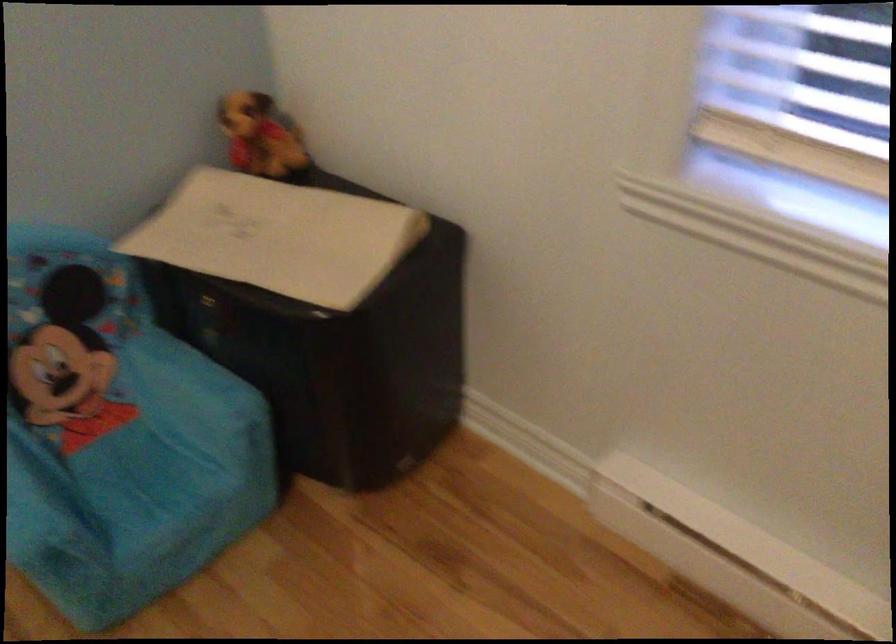
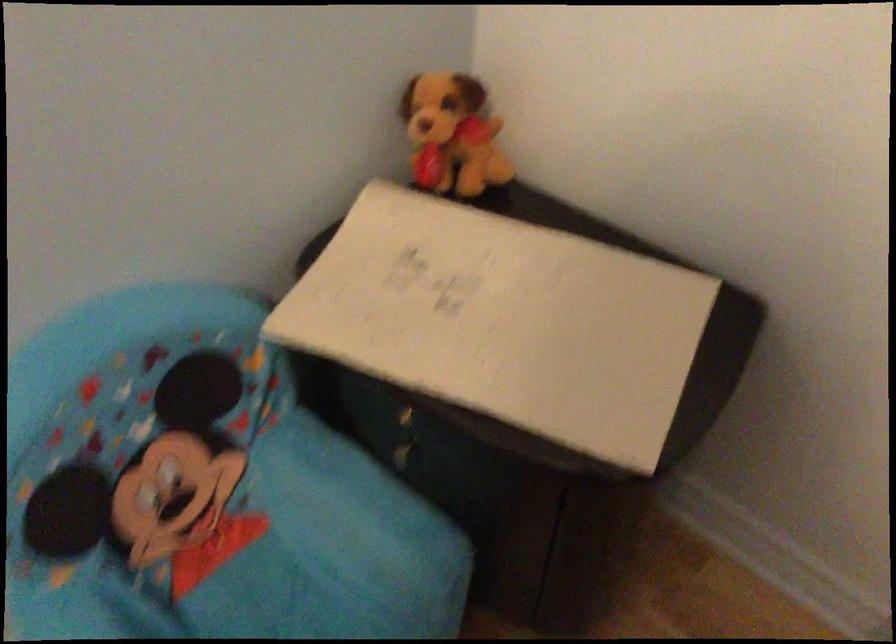
The point at (290, 243) is marked in the first image. Where is the corresponding point in the second image?

(521, 323)